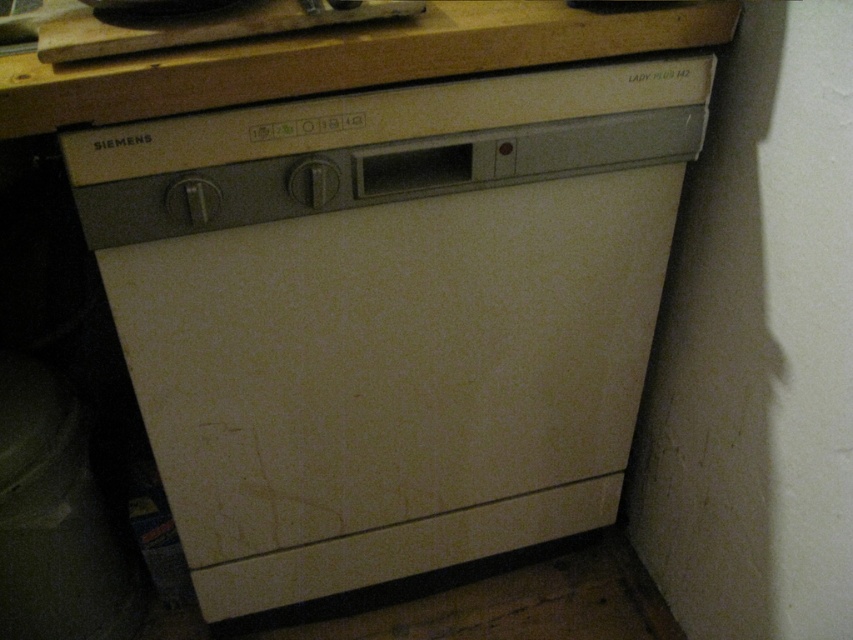
Does point (306, 243) lie behind point (560, 38)?

That is True.

Is beige matte dishwasher at center below wooden at upper center?

Correct, beige matte dishwasher at center is located below wooden at upper center.

Between point (561, 349) and point (0, 83), which one is positioned behind?

The point (561, 349) is behind.

Identify the location of beige matte dishwasher at center. (390, 314).